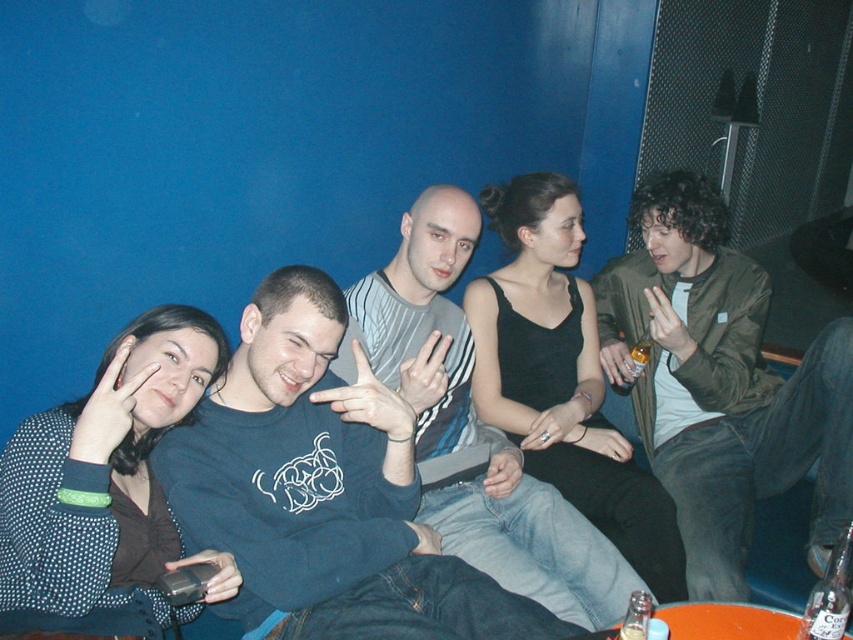
You are a photographer trying to capture a candid shot of the striped jersey at center without including the green matte jacket at right in the frame. Is this possible given their positions?

The striped jersey at center is behind the green matte jacket at right, so it would be blocked from view. You cannot capture the striped jersey at center without the green matte jacket at right in the frame.